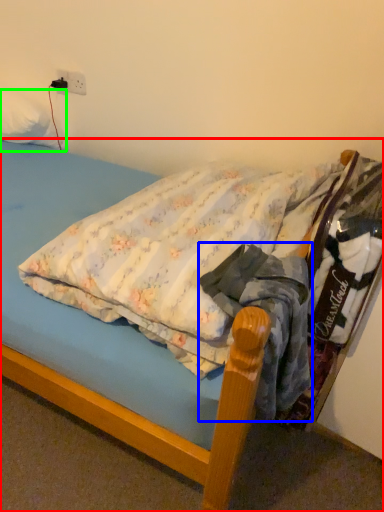
Question: Considering the real-world distances, which object is closest to bed (highlighted by a red box)? clothing (highlighted by a blue box) or pillow (highlighted by a green box).

Choices:
 (A) clothing
 (B) pillow

Answer: (A)